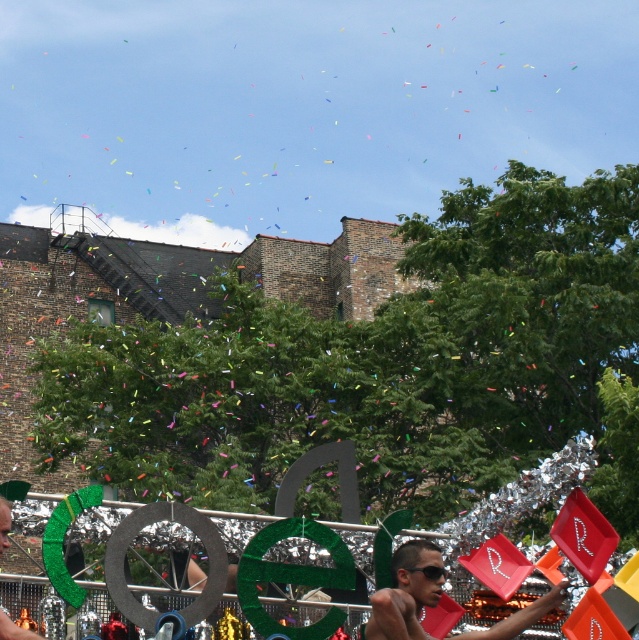
You are a photographer standing at the camera position. You want to capture a photo of the shiny black sunglasses at center. Given that your camera has a maximum zoom range of 100 feet, can you clearly capture the sunglasses without moving closer?

The shiny black sunglasses at center and camera are 158.87 feet apart. Since the maximum zoom range of your camera is 100 feet, you cannot clearly capture the sunglasses without moving closer.

You are a participant in the parade and need to choose between the shiny metallic sunglasses at center and the black plastic goggles at center. Which one is thinner?

The shiny metallic sunglasses at center is thinner than the black plastic goggles at center.

You are a participant in the parade and want to choose a pair of sunglasses that is larger. Which one should you pick between the shiny black sunglasses at center and the shiny metallic sunglasses at center?

You should pick the shiny metallic sunglasses at center because it is larger than the shiny black sunglasses at center.